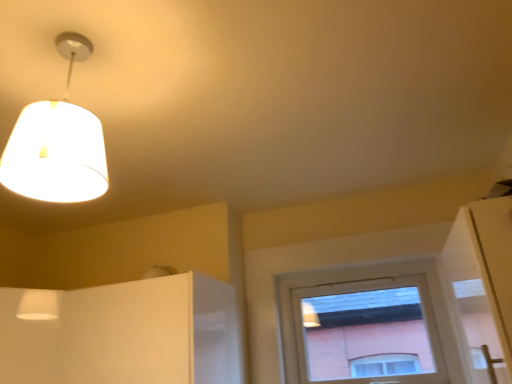
Question: From a real-world perspective, relative to white glossy cabinet at lower left, is matte white window at center vertically above or below?

Choices:
 (A) above
 (B) below

Answer: (A)

Question: Do you think matte white window at center is within white glossy cabinet at lower left, or outside of it?

Choices:
 (A) outside
 (B) inside

Answer: (A)

Question: Which of these objects is positioned farthest from the white glossy cabinet at lower left?

Choices:
 (A) white fabric lampshade at upper left
 (B) matte white window at center

Answer: (B)

Question: Which is nearer to the white fabric lampshade at upper left?

Choices:
 (A) white glossy cabinet at lower left
 (B) matte white window at center

Answer: (A)